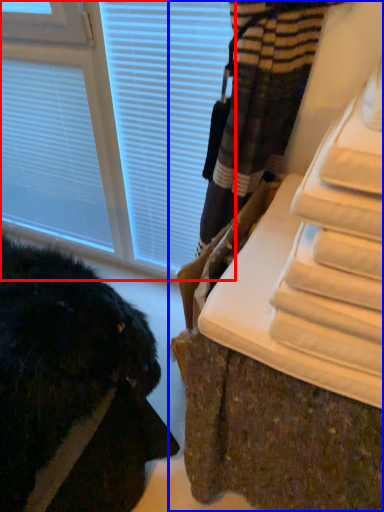
Question: Among these objects, which one is nearest to the camera, window (highlighted by a red box) or furniture (highlighted by a blue box)?

Choices:
 (A) window
 (B) furniture

Answer: (B)